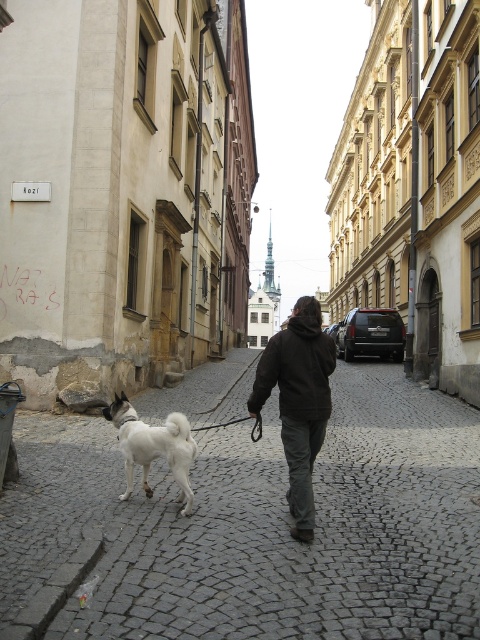
You are standing at the point labeled as point (458, 589) and want to walk to the point labeled as point (173, 412). Given the narrow cobblestone street, will you have to walk towards the camera or away from it?

You will have to walk away from the camera because point (173, 412) is further from the camera than point (458, 589).

You are a delivery person carrying a package that requires a 2.5 meter clearance to maneuver safely. You see the dark brown hoodie at center and the white fluffy dog at lower left in the street. Can you safely navigate between them with your package?

The distance between the dark brown hoodie at center and the white fluffy dog at lower left is 2.43 meters, which is slightly less than the required 2.5 meters clearance. Therefore, it might not be safe to navigate between them with the package.